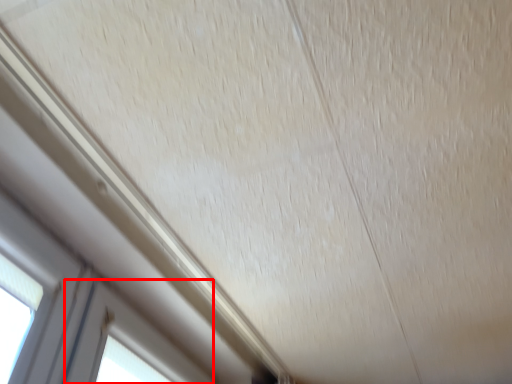
Question: From the image's perspective, considering the relative positions of window (annotated by the red box) and window in the image provided, where is window (annotated by the red box) located with respect to the staircase?

Choices:
 (A) above
 (B) below

Answer: (B)